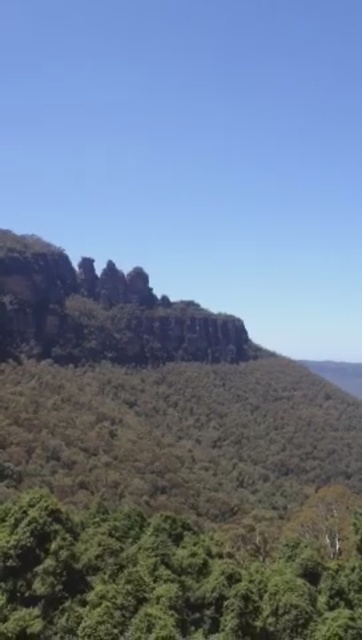
Does point (359, 554) come behind point (166, 563)?

Yes, it is.

Identify the location of rocky cliff at center. (165, 468).